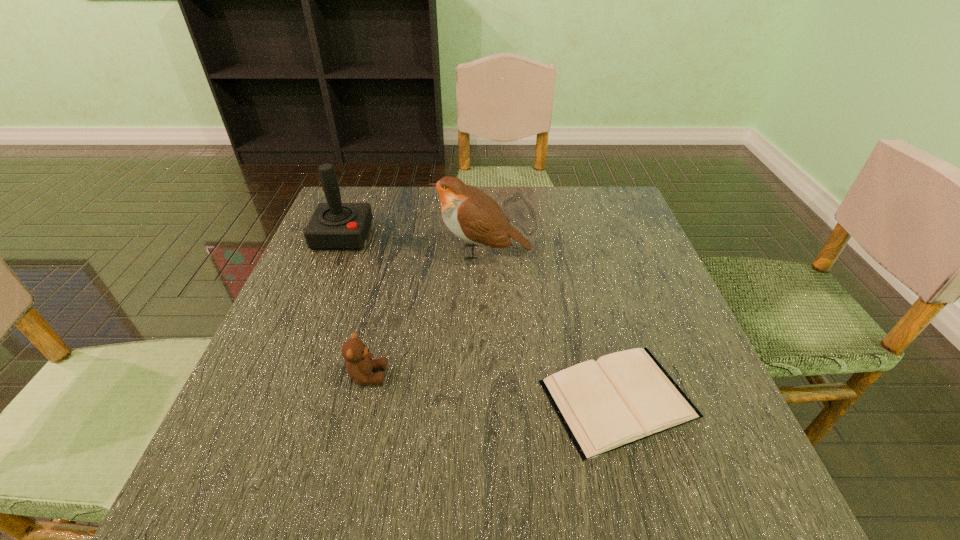
The width and height of the screenshot is (960, 540). Identify the location of free location that satisfies the following two spatial constraints: 1. at the face of the bird; 2. on the left side of the shortest object. (484, 399).

The width and height of the screenshot is (960, 540). What are the coordinates of `blank space that satisfies the following two spatial constraints: 1. on the face of the third object from right to left; 2. on the right side of the hardback book` in the screenshot? It's located at (362, 399).

Where is `vacant space that satisfies the following two spatial constraints: 1. on the face of the teddy bear; 2. on the left side of the hardback book`? vacant space that satisfies the following two spatial constraints: 1. on the face of the teddy bear; 2. on the left side of the hardback book is located at coordinates (362, 399).

Find the location of `free space in the image that satisfies the following two spatial constraints: 1. on the face of the second object from left to right; 2. on the left side of the hardback book`. free space in the image that satisfies the following two spatial constraints: 1. on the face of the second object from left to right; 2. on the left side of the hardback book is located at coordinates (362, 399).